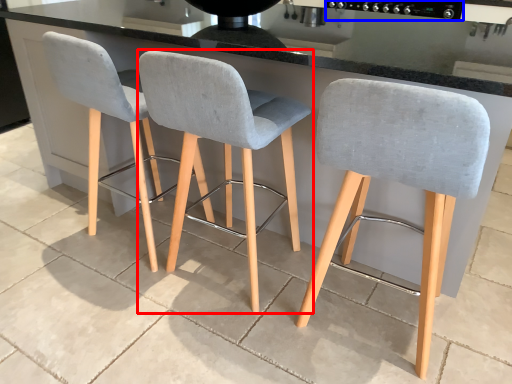
Question: Which object appears farthest to the camera in this image, chair (highlighted by a red box) or appliance (highlighted by a blue box)?

Choices:
 (A) chair
 (B) appliance

Answer: (B)